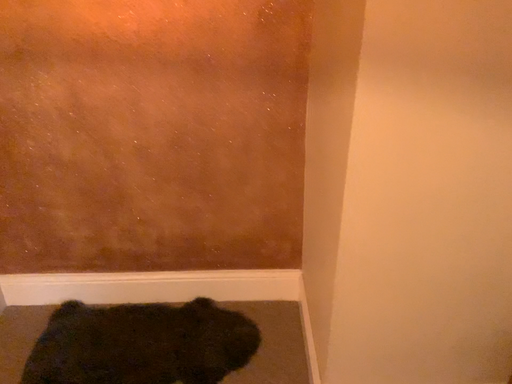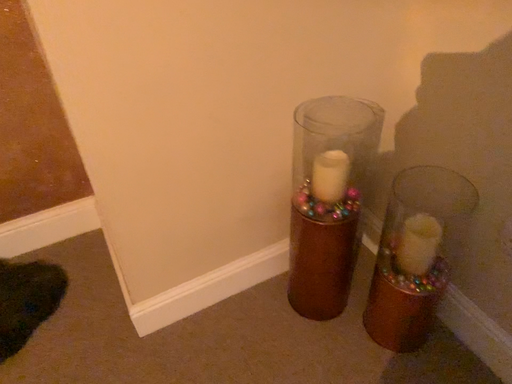
Question: How did the camera likely rotate when shooting the video?

Choices:
 (A) rotated upward
 (B) rotated downward

Answer: (B)